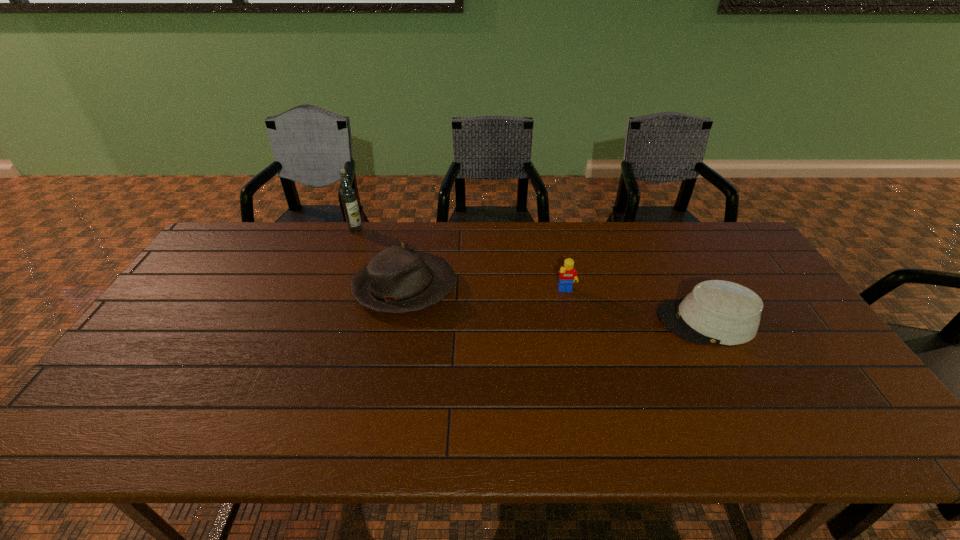
This screenshot has width=960, height=540. In order to click on vacant space that's between the Lego and the shortest object in this screenshot , I will do `click(636, 306)`.

Locate an element on the screen. free space that is in between the farthest object and the shortest object is located at coordinates (531, 275).

Find the location of a particular element. free space between the Lego and the leftmost object is located at coordinates (461, 260).

Where is `unoccupied position between the tallest object and the Lego`? The width and height of the screenshot is (960, 540). unoccupied position between the tallest object and the Lego is located at coordinates (461, 260).

The height and width of the screenshot is (540, 960). I want to click on vacant area that lies between the second object from right to left and the left hat, so click(485, 290).

The height and width of the screenshot is (540, 960). In order to click on vacant space that is in between the shorter hat and the second object from left to right in this screenshot , I will do `click(555, 305)`.

The image size is (960, 540). Find the location of `vacant space that is in between the third object from right to left and the shorter hat`. vacant space that is in between the third object from right to left and the shorter hat is located at coordinates coord(555,305).

Locate an element on the screen. The image size is (960, 540). empty location between the second object from right to left and the vodka is located at coordinates (461, 260).

Locate an element on the screen. vacant point located between the right hat and the vodka is located at coordinates 531,275.

This screenshot has width=960, height=540. In order to click on empty space between the second object from right to left and the third object from right to left in this screenshot , I will do point(485,290).